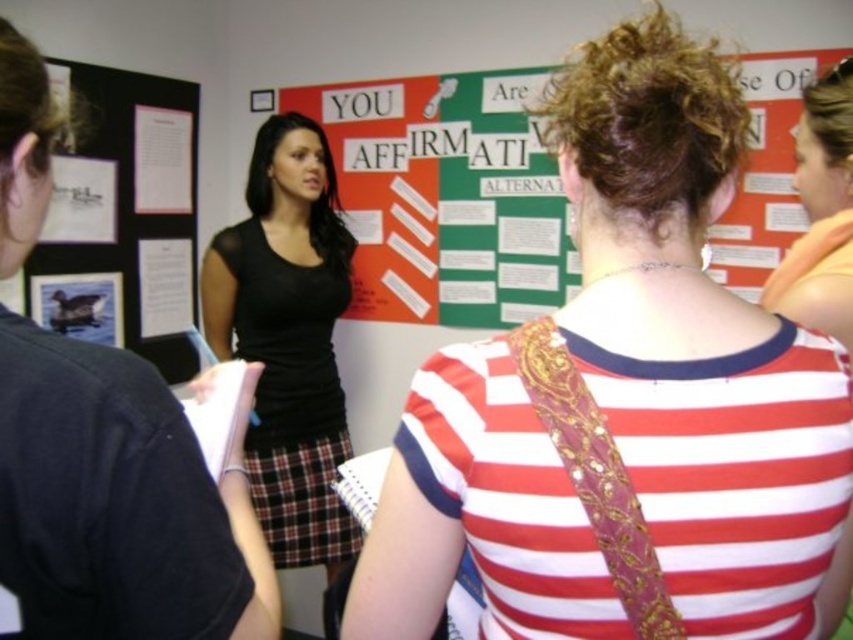
You are standing in the classroom and want to place a 15 inch wide book between the green paper poster at center and the black mesh top at center. Can the book fit in the space between them?

The distance between the green paper poster at center and the black mesh top at center is 18.42 inches. Since the book is 15 inches wide, it can fit in the space between them as there is enough room.

You are standing in the classroom and want to hand out a note to both the person wearing the black mesh top at center and the orange fabric shirt at upper right. If you can only move 4 feet, can you reach both individuals without moving further than that?

The black mesh top at center and orange fabric shirt at upper right are 4.39 feet apart. Since you can only move 4 feet, you cannot reach both individuals without exceeding the distance limit.

Consider the image. You are standing in the classroom and need to place a new item between the green paper poster at center and the black mesh top at center. Based on their positions, which object should be on the left side of the new item?

The black mesh top at center is to the left of the green paper poster at center, so the new item should be placed between them with the black mesh top at center on the left side.